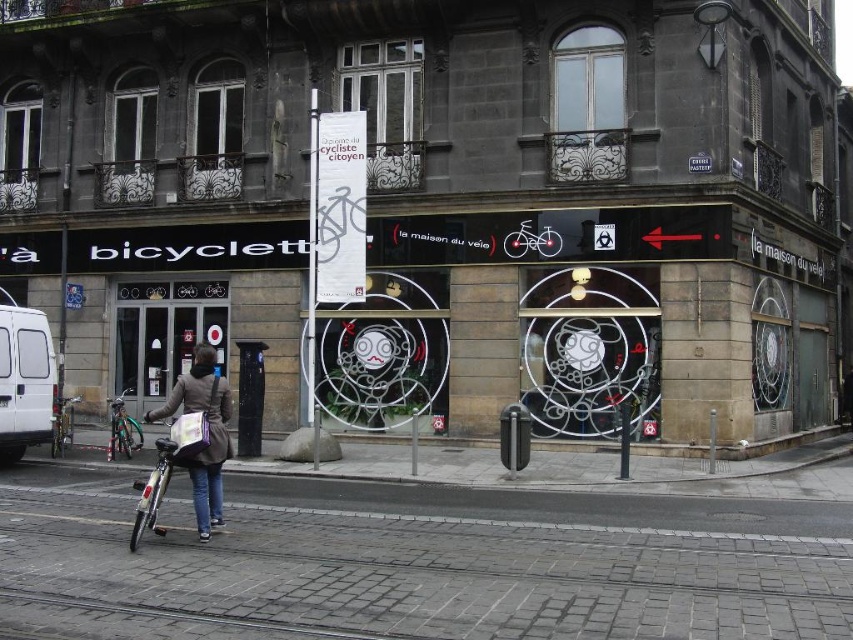
Question: Which of the following is the closest to the observer?

Choices:
 (A) matte brown jacket at center
 (B) shiny silver bicycle at lower left

Answer: (B)

Question: Based on their relative distances, which object is nearer to the silver metallic bicycle at lower left?

Choices:
 (A) shiny silver bicycle at lower left
 (B) white matte van at lower left
 (C) matte brown jacket at center

Answer: (B)

Question: Does matte brown jacket at center have a greater width compared to shiny silver bicycle at lower left?

Choices:
 (A) no
 (B) yes

Answer: (B)

Question: From the image, what is the correct spatial relationship of shiny silver bicycle at lower left in relation to silver metallic bicycle at lower left?

Choices:
 (A) below
 (B) above

Answer: (B)

Question: Can you confirm if white matte van at lower left is positioned above matte brown jacket at center?

Choices:
 (A) yes
 (B) no

Answer: (A)

Question: Which point appears farthest from the camera in this image?

Choices:
 (A) (163, 442)
 (B) (126, 422)
 (C) (38, 321)

Answer: (B)